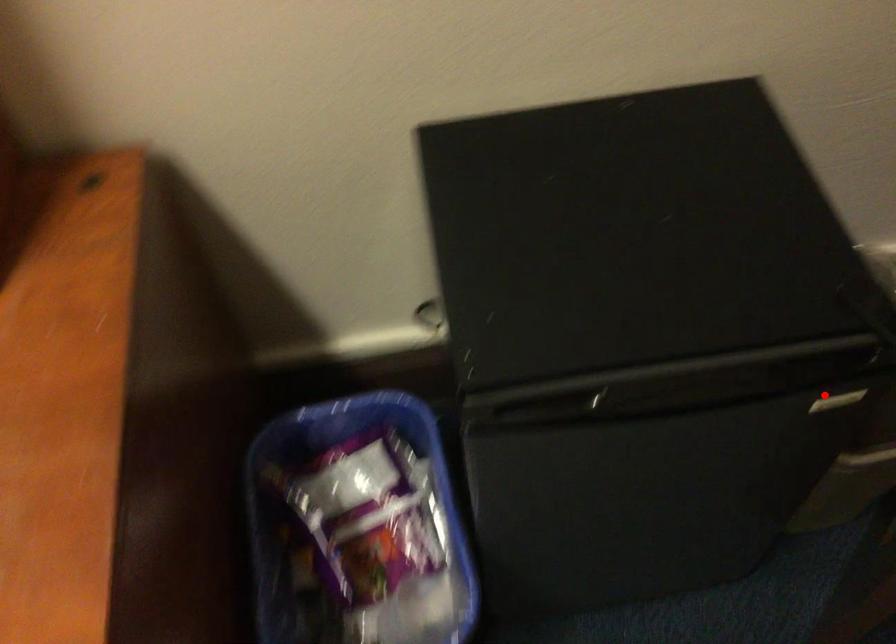
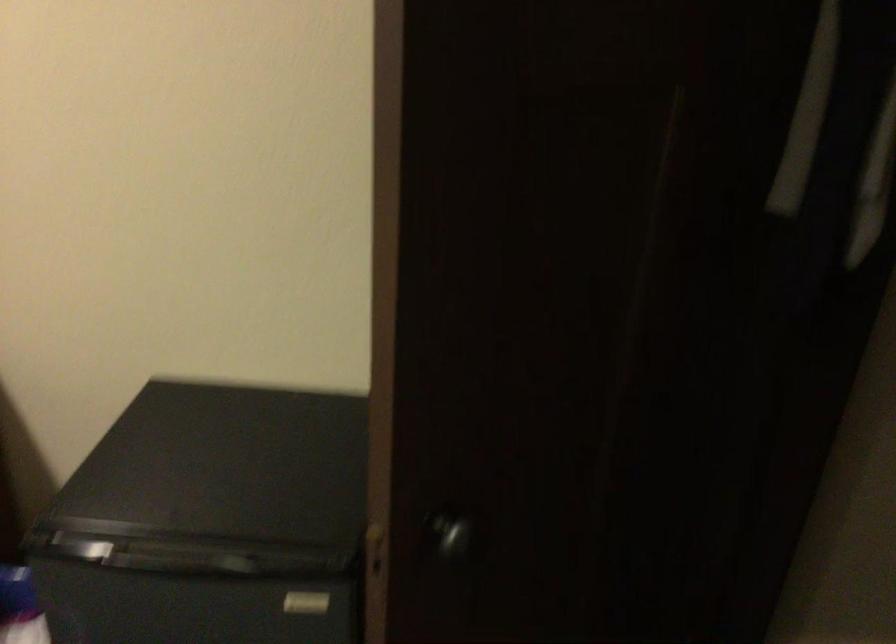
In the second image, find the point that corresponds to the highlighted location in the first image.

(306, 603)